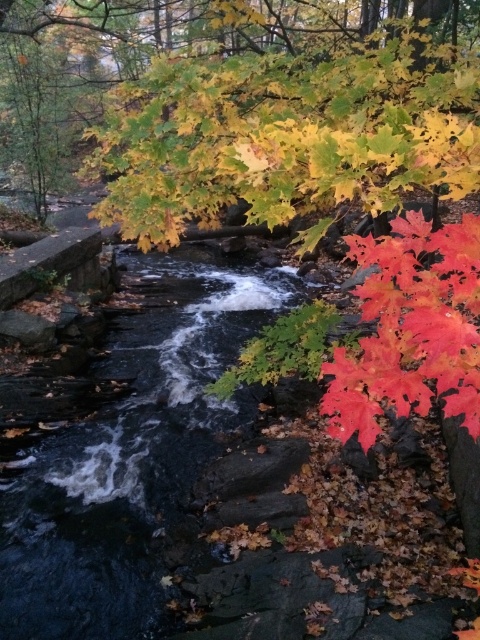
Question: Does vivid red maple leaf at right appear on the right side of bright red maple leaf at lower right?

Choices:
 (A) yes
 (B) no

Answer: (A)

Question: Which of the following is the closest to the observer?

Choices:
 (A) (347, 390)
 (B) (463, 236)
 (C) (104, 605)

Answer: (B)

Question: From the image, what is the correct spatial relationship of dark gray stone stream at center in relation to vivid red maple leaf at right?

Choices:
 (A) below
 (B) above

Answer: (A)

Question: Among these points, which one is farthest from the camera?

Choices:
 (A) (375, 278)
 (B) (6, 513)

Answer: (B)

Question: Can you confirm if dark gray stone stream at center is smaller than bright red maple leaf at lower right?

Choices:
 (A) no
 (B) yes

Answer: (A)

Question: Which object appears farthest from the camera in this image?

Choices:
 (A) bright red maple leaf at lower right
 (B) vivid red maple leaf at right

Answer: (A)